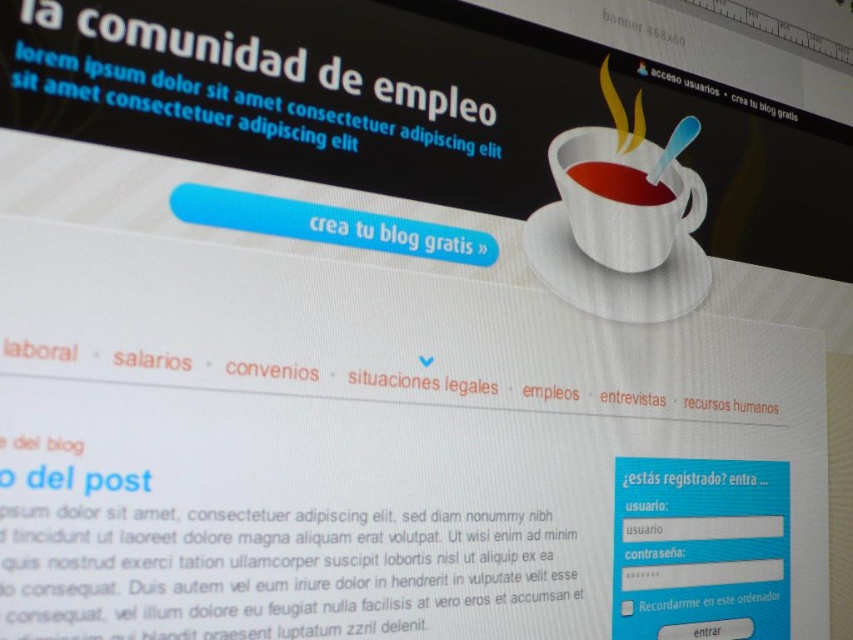
Question: Can you confirm if matte white cup at upper right is positioned to the right of matte ceramic cup at upper right?

Choices:
 (A) yes
 (B) no

Answer: (A)

Question: Is matte white cup at upper right wider than matte ceramic cup at upper right?

Choices:
 (A) yes
 (B) no

Answer: (A)

Question: Is matte white cup at upper right to the right of matte ceramic cup at upper right from the viewer's perspective?

Choices:
 (A) yes
 (B) no

Answer: (A)

Question: Which object is farther from the camera taking this photo?

Choices:
 (A) matte ceramic cup at upper right
 (B) matte white cup at upper right

Answer: (A)